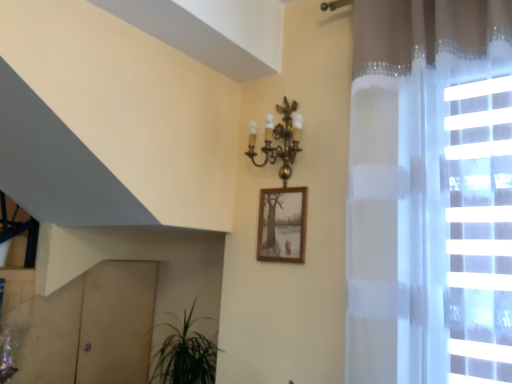
The width and height of the screenshot is (512, 384). What do you see at coordinates (282, 225) in the screenshot? I see `wooden framed picture at upper center` at bounding box center [282, 225].

You are a GUI agent. You are given a task and a screenshot of the screen. Output one action in this format:
    pyautogui.click(x=<x>, y=<y>)
    Task: Click on the wooden framed picture at upper center
    This screenshot has height=384, width=512.
    Given the screenshot: What is the action you would take?
    pyautogui.click(x=282, y=225)

Where is `wooden framed picture at upper center`? wooden framed picture at upper center is located at coordinates (282, 225).